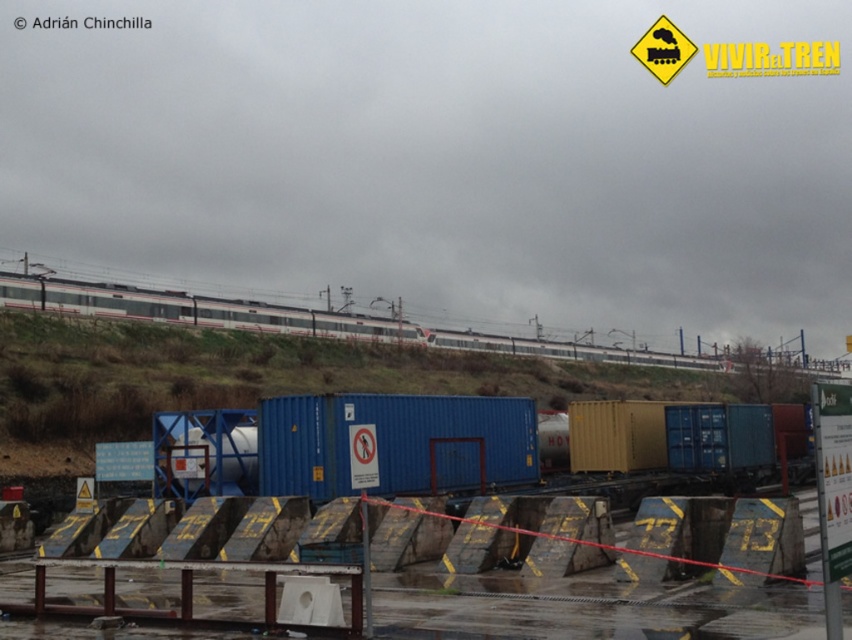
Question: Is blue metallic shipping container at center closer to camera compared to white glossy train at upper center?

Choices:
 (A) no
 (B) yes

Answer: (B)

Question: Can you confirm if blue metallic shipping container at center is positioned to the left of white glossy train at upper center?

Choices:
 (A) no
 (B) yes

Answer: (B)

Question: Among these points, which one is nearest to the camera?

Choices:
 (A) (331, 442)
 (B) (117, 292)

Answer: (A)

Question: Does blue metallic shipping container at center appear on the right side of white glossy train at upper center?

Choices:
 (A) no
 (B) yes

Answer: (A)

Question: Which point appears closest to the camera in this image?

Choices:
 (A) (706, 365)
 (B) (262, 440)

Answer: (B)